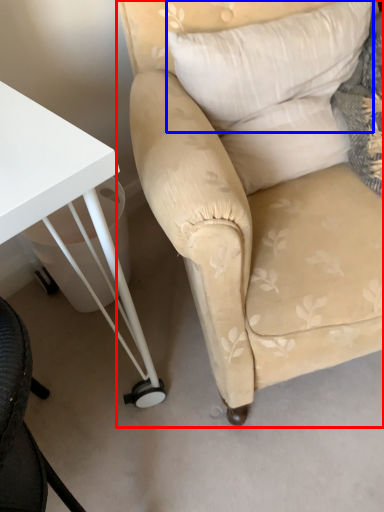
Question: Which object appears closest to the camera in this image, chair (highlighted by a red box) or pillow (highlighted by a blue box)?

Choices:
 (A) chair
 (B) pillow

Answer: (A)